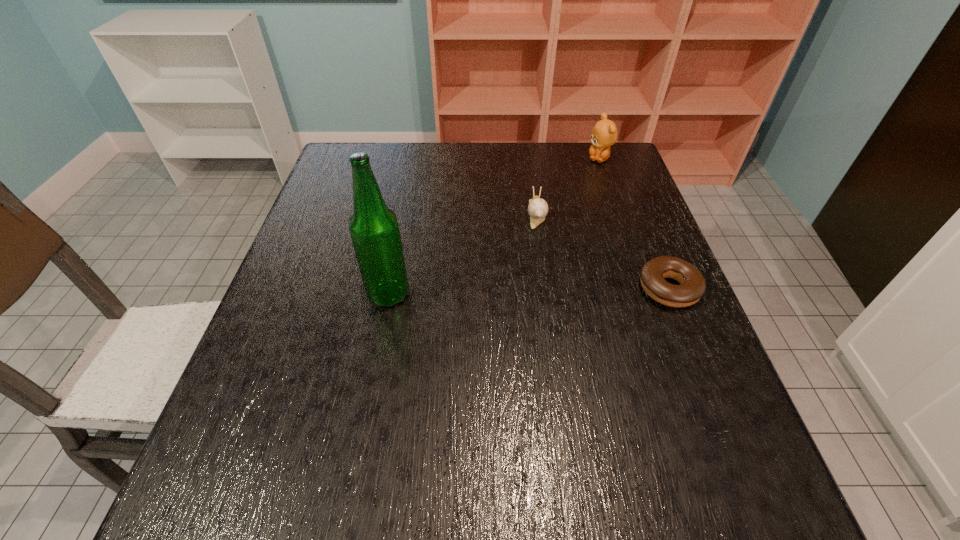
The height and width of the screenshot is (540, 960). I want to click on free space on the desktop that is between the leftmost object and the doughnut and is positioned on the shell of the second object from left to right, so click(x=542, y=291).

I want to click on vacant space on the desktop that is between the beer bottle and the doughnut and is positioned on the face of the second tallest object, so click(492, 292).